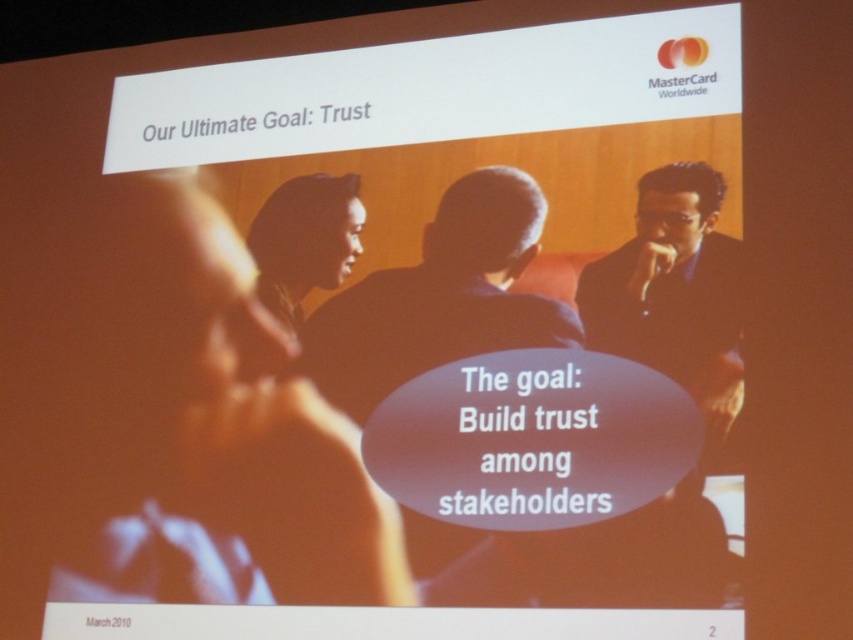
You are an event planner observing the slide and need to ensure that the dark blue suit at center and the dark skin smooth face at center are both visible to the audience. Based on their positions and sizes, which object might require adjustment to ensure visibility?

The dark blue suit at center might be wider than dark skin smooth face at center, so the dark blue suit at center could potentially block part of the dark skin smooth face at center. To ensure both are visible, adjusting their positions or resizing them might be necessary.

You are an employee attending a virtual meeting where this slide is being presented. You notice two points on the slide marked as point 1 at position (442, 250) and point 2 at position (312, 225). Which point is closer to you as you view the slide?

Point (442, 250) is closer to the viewer than point (312, 225).

You are a photographer standing at a distance of 2 meters from the camera. You want to take a photo of the smooth skin face at center so that it appears larger in the photo. Should you move closer to or farther away from the camera?

The smooth skin face at center is currently 2.47 meters from the camera. To make it appear larger in the photo, you should move closer to the camera, decreasing the distance between yourself and the face.